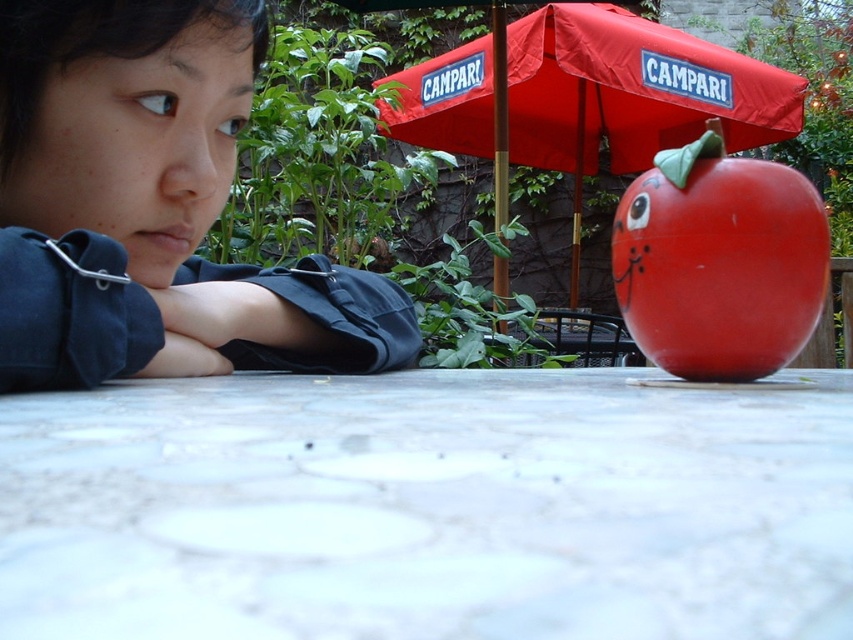
Does red fabric umbrella at upper center have a larger size compared to glossy plastic apple at center?

Yes.

Between red fabric umbrella at upper center and glossy plastic apple at center, which one has more height?

Standing taller between the two is red fabric umbrella at upper center.

Identify the location of red fabric umbrella at upper center. This screenshot has height=640, width=853. (589, 97).

Locate an element on the screen. This screenshot has height=640, width=853. red fabric umbrella at upper center is located at coordinates (589, 97).

Is the position of matte black shirt at lower left more distant than that of glossy plastic apple at center?

No, it is in front of glossy plastic apple at center.

Which is above, matte black shirt at lower left or glossy plastic apple at center?

Positioned higher is glossy plastic apple at center.

At what (x,y) coordinates should I click in order to perform the action: click on matte black shirt at lower left. Please return your answer as a coordinate pair (x, y). Looking at the image, I should click on coord(151,205).

Can you confirm if matte black shirt at lower left is wider than red fabric umbrella at upper center?

No, matte black shirt at lower left is not wider than red fabric umbrella at upper center.

Does point (70, 212) lie behind point (492, 49)?

No, (70, 212) is in front of (492, 49).

I want to click on matte black shirt at lower left, so click(151, 205).